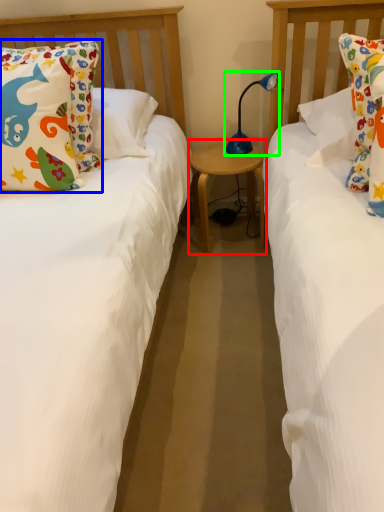
Question: Which object is the closest to the table (highlighted by a red box)? Choose among these: pillow (highlighted by a blue box) or table lamp (highlighted by a green box).

Choices:
 (A) pillow
 (B) table lamp

Answer: (B)